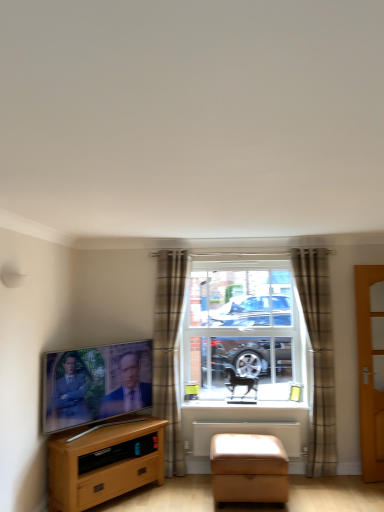
Where is `matte black tv at left`? matte black tv at left is located at coordinates (95, 384).

Describe the element at coordinates (248, 468) in the screenshot. I see `tan leather footrest at lower center` at that location.

The height and width of the screenshot is (512, 384). Find the location of `tan leather footrest at lower center`. tan leather footrest at lower center is located at coordinates (248, 468).

Consider the image. Measure the distance between point (x=307, y=294) and camera.

Point (x=307, y=294) is 4.11 meters from camera.

This screenshot has width=384, height=512. What are the coordinates of `matte black tv at left` in the screenshot? It's located at (95, 384).

Considering the positions of objects light brown wood tv stand at lower left and white plastic window sill at center in the image provided, who is more to the left, light brown wood tv stand at lower left or white plastic window sill at center?

light brown wood tv stand at lower left.

Are light brown wood tv stand at lower left and white plastic window sill at center located far from each other?

light brown wood tv stand at lower left is near white plastic window sill at center, not far away.

Who is shorter, light brown wood tv stand at lower left or white plastic window sill at center?

white plastic window sill at center.

Who is smaller, light brown wood tv stand at lower left or white plastic window sill at center?

With smaller size is white plastic window sill at center.

Which is correct: tan leather footrest at lower center is inside plaid fabric curtain at center, positioned as the 2th curtain in right-to-left order, or outside of it?

tan leather footrest at lower center is outside plaid fabric curtain at center, positioned as the 2th curtain in right-to-left order.

Is point (265, 450) farther from viewer compared to point (173, 280)?

No.

From a real-world perspective, is tan leather footrest at lower center physically located above or below plaid fabric curtain at center, the 1th curtain in the left-to-right sequence?

Clearly, from a real-world perspective, tan leather footrest at lower center is below plaid fabric curtain at center, the 1th curtain in the left-to-right sequence.

Consider the image. Considering the relative sizes of wooden door at right and light brown wood tv stand at lower left in the image provided, is wooden door at right thinner than light brown wood tv stand at lower left?

Indeed, wooden door at right has a lesser width compared to light brown wood tv stand at lower left.

Which object is further away from the camera, wooden door at right or light brown wood tv stand at lower left?

wooden door at right is further away from the camera.

From the image's perspective, which one is positioned higher, wooden door at right or light brown wood tv stand at lower left?

wooden door at right is shown above in the image.

Is matte black tv at left not inside wooden door at right?

matte black tv at left lies outside wooden door at right's area.

Is matte black tv at left facing away from wooden door at right?

No, matte black tv at left is not facing away from wooden door at right.

There is a matte black tv at left. At what (x,y) coordinates should I click in order to perform the action: click on door above it (from a real-world perspective). Please return your answer as a coordinate pair (x, y). The height and width of the screenshot is (512, 384). Looking at the image, I should click on (371, 367).

Which of these two, brown plaid curtain at center, the 2th curtain when ordered from left to right, or wooden door at right, is bigger?

Bigger between the two is brown plaid curtain at center, the 2th curtain when ordered from left to right.

From a real-world perspective, between brown plaid curtain at center, the 1th curtain from the right, and wooden door at right, who is vertically lower?

wooden door at right, from a real-world perspective.

Is brown plaid curtain at center, the 1th curtain from the right, positioned far away from wooden door at right?

brown plaid curtain at center, the 1th curtain from the right, is near wooden door at right, not far away.

Could you tell me if brown plaid curtain at center, the 2th curtain when ordered from left to right, is turned towards wooden door at right?

No, brown plaid curtain at center, the 2th curtain when ordered from left to right, is not facing towards wooden door at right.

From the image's perspective, who appears lower, plaid fabric curtain at center, positioned as the 2th curtain in right-to-left order, or white plastic window sill at center?

white plastic window sill at center appears lower in the image.

Consider the image. How different are the orientations of plaid fabric curtain at center, positioned as the 2th curtain in right-to-left order, and white plastic window sill at center in degrees?

The angle between the facing direction of plaid fabric curtain at center, positioned as the 2th curtain in right-to-left order, and the facing direction of white plastic window sill at center is 0.963 degrees.

Is point (176, 250) positioned after point (210, 408)?

Yes.

In terms of width, does plaid fabric curtain at center, the 1th curtain in the left-to-right sequence, look wider or thinner when compared to white plastic window sill at center?

In the image, plaid fabric curtain at center, the 1th curtain in the left-to-right sequence, appears to be more narrow than white plastic window sill at center.

Would you say light brown wood tv stand at lower left is part of clear glass window at center's contents?

No, light brown wood tv stand at lower left is not inside clear glass window at center.

Identify the location of window lying on the right of light brown wood tv stand at lower left. The width and height of the screenshot is (384, 512). (243, 332).

From the image's perspective, relative to light brown wood tv stand at lower left, is clear glass window at center above or below?

Clearly, from the image's perspective, clear glass window at center is above light brown wood tv stand at lower left.

At what (x,y) coordinates should I click in order to perform the action: click on cabinetry in front of the white plastic window sill at center. Please return your answer as a coordinate pair (x, y). The height and width of the screenshot is (512, 384). Looking at the image, I should click on (105, 462).

From the image's perspective, starting from the tan leather footrest at lower center, which curtain is the 1st one above? Please provide its 2D coordinates.

[(168, 352)]

From the image, which object appears to be nearer to brown plaid curtain at center, the 2th curtain when ordered from left to right, matte black tv at left or plaid fabric curtain at center, the 1th curtain in the left-to-right sequence?

plaid fabric curtain at center, the 1th curtain in the left-to-right sequence, is positioned closer to the anchor brown plaid curtain at center, the 2th curtain when ordered from left to right.

Considering their positions, is plaid fabric curtain at center, the 1th curtain in the left-to-right sequence, positioned closer to white plastic window sill at center than white plastic radiator at lower center?

Based on the image, white plastic radiator at lower center appears to be nearer to white plastic window sill at center.

From the image, which object appears to be nearer to matte black tv at left, white plastic window sill at center or light brown wood tv stand at lower left?

The object closer to matte black tv at left is light brown wood tv stand at lower left.

Considering their positions, is white plastic window sill at center positioned further to white plastic radiator at lower center than brown plaid curtain at center, the 1th curtain from the right?

brown plaid curtain at center, the 1th curtain from the right, lies further to white plastic radiator at lower center than the other object.

Looking at the image, which one is located closer to white plastic window sill at center, clear glass window at center or plaid fabric curtain at center, positioned as the 2th curtain in right-to-left order?

Based on the image, clear glass window at center appears to be nearer to white plastic window sill at center.

Looking at the image, which one is located closer to light brown wood tv stand at lower left, plaid fabric curtain at center, positioned as the 2th curtain in right-to-left order, or tan leather footrest at lower center?

plaid fabric curtain at center, positioned as the 2th curtain in right-to-left order, is positioned closer to the anchor light brown wood tv stand at lower left.

Estimate the real-world distances between objects in this image. Which object is further from matte black tv at left, light brown wood tv stand at lower left or tan leather footrest at lower center?

tan leather footrest at lower center is positioned further to the anchor matte black tv at left.

Based on the photo, looking at the image, which one is located further to tan leather footrest at lower center, white plastic radiator at lower center or matte black tv at left?

The object further to tan leather footrest at lower center is matte black tv at left.

This screenshot has height=512, width=384. What are the coordinates of `footrest between light brown wood tv stand at lower left and white plastic radiator at lower center in the horizontal direction` in the screenshot? It's located at (248, 468).

Image resolution: width=384 pixels, height=512 pixels. What are the coordinates of `radiator between plaid fabric curtain at center, the 1th curtain in the left-to-right sequence, and tan leather footrest at lower center in the up-down direction` in the screenshot? It's located at (247, 433).

You are a GUI agent. You are given a task and a screenshot of the screen. Output one action in this format:
    pyautogui.click(x=<x>, y=<y>)
    Task: Click on the curtain between light brown wood tv stand at lower left and clear glass window at center in the horizontal direction
    The width and height of the screenshot is (384, 512).
    Given the screenshot: What is the action you would take?
    pyautogui.click(x=168, y=352)

Find the location of a particular element. window sill between clear glass window at center and white plastic radiator at lower center in the vertical direction is located at coordinates (243, 408).